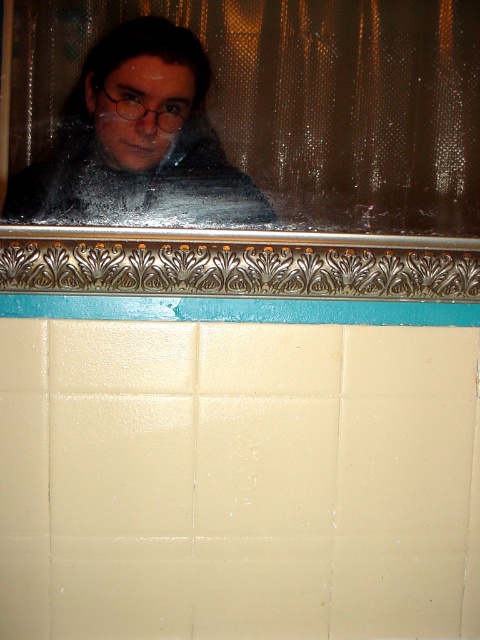
Question: Which point is closer to the camera taking this photo?

Choices:
 (A) (137, 20)
 (B) (332, 10)

Answer: (A)

Question: Which point is farther to the camera?

Choices:
 (A) metallic frame at upper center
 (B) matte black scarf at upper center

Answer: (B)

Question: Can you confirm if metallic frame at upper center is thinner than matte black scarf at upper center?

Choices:
 (A) no
 (B) yes

Answer: (A)

Question: Does metallic frame at upper center have a larger size compared to matte black scarf at upper center?

Choices:
 (A) yes
 (B) no

Answer: (A)

Question: Is metallic frame at upper center bigger than matte black scarf at upper center?

Choices:
 (A) no
 (B) yes

Answer: (B)